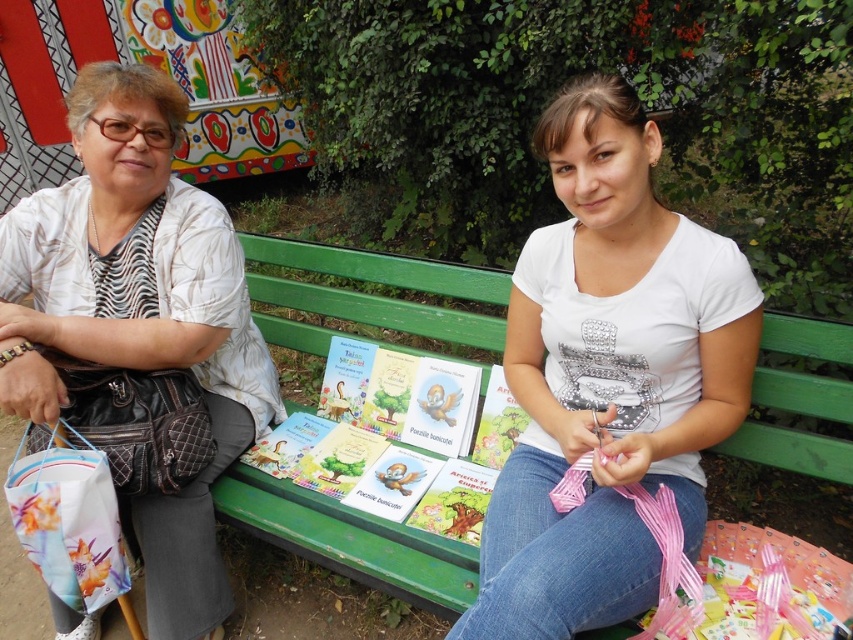
Question: Which of the following is the closest to the observer?

Choices:
 (A) green painted wood park bench at center
 (B) white textured jacket at upper left
 (C) white matte shirt at center

Answer: (C)

Question: Does green painted wood park bench at center appear under matte paper book at center?

Choices:
 (A) yes
 (B) no

Answer: (B)

Question: Is white matte shirt at center above matte paper book at center?

Choices:
 (A) no
 (B) yes

Answer: (B)

Question: From the image, what is the correct spatial relationship of white textured jacket at upper left in relation to green painted wood park bench at center?

Choices:
 (A) below
 (B) above

Answer: (A)

Question: Which object is farther from the camera taking this photo?

Choices:
 (A) white textured jacket at upper left
 (B) white matte shirt at center

Answer: (A)

Question: Which object is positioned closest to the white matte shirt at center?

Choices:
 (A) green painted wood park bench at center
 (B) white textured jacket at upper left
 (C) matte paper book at center

Answer: (C)